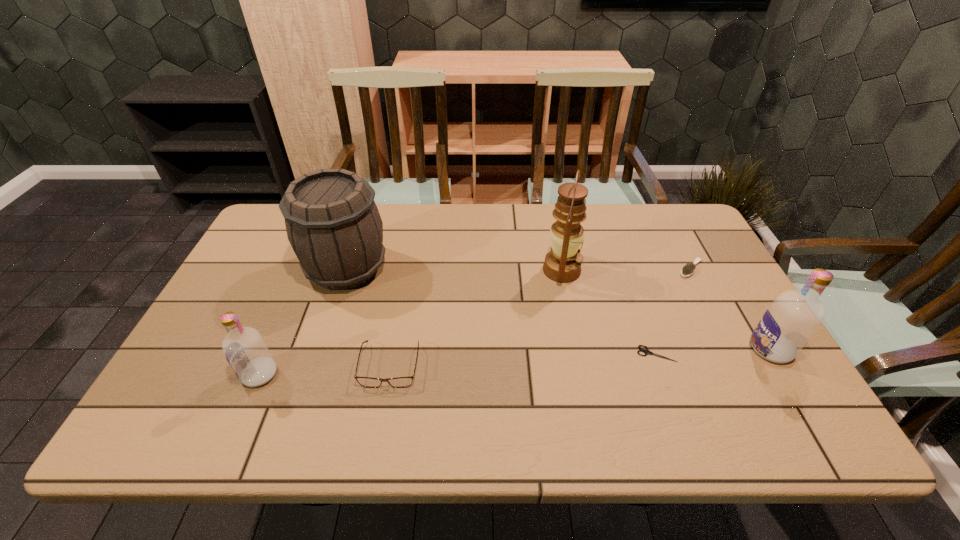
If the aim is uniform spacing by inserting an additional vodka among them, please point to a vacant space for this new vodka. Please provide its 2D coordinates. Your answer should be formatted as a tuple, i.e. [(x, y)], where the tuple contains the x and y coordinates of a point satisfying the conditions above.

[(521, 361)]